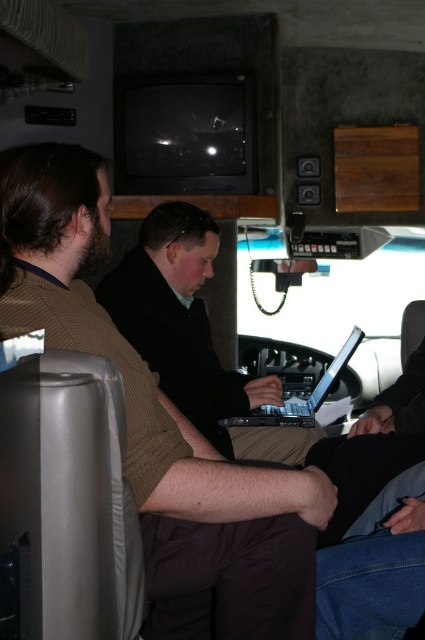
You are organizing a tech event and need to arrange two laptops on a table. The laptops are the black matte laptop at center and the silver metallic laptop at center. According to the image, which laptop should be placed to the left if you want to replicate the original arrangement?

The black matte laptop at center should be placed to the left of the silver metallic laptop at center to replicate the original arrangement.

In the scene shown: You are a passenger in the vehicle and need to place both the black matte laptop at center and the silver metallic laptop at center into a storage compartment that can only hold one laptop at a time. Based on their sizes, which laptop should you store first to ensure both fit?

The black matte laptop at center is larger in size than the silver metallic laptop at center, so you should store the black matte laptop at center first to ensure there is enough space for the smaller silver metallic laptop at center afterward.